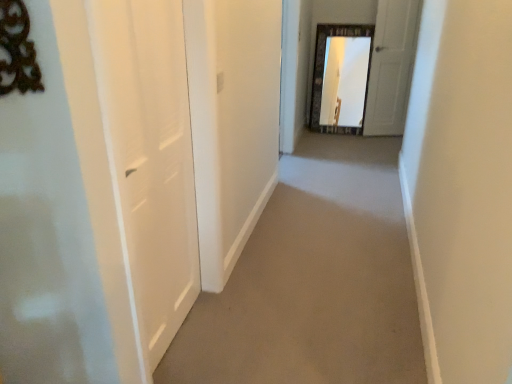
This screenshot has height=384, width=512. Describe the element at coordinates (391, 66) in the screenshot. I see `white matte door at upper right, arranged as the 2th door when viewed from the front` at that location.

What is the approximate width of white matte door at upper right, positioned as the second door in left-to-right order?

It is 2.11 inches.

This screenshot has width=512, height=384. What do you see at coordinates (314, 281) in the screenshot? I see `beige carpet at center` at bounding box center [314, 281].

Identify the location of white matte door at left, which is counted as the 1th door, starting from the front. This screenshot has height=384, width=512. (149, 160).

Which object is thinner, white matte door at upper right, arranged as the 2th door when viewed from the front, or white matte door at left, marked as the first door in a bottom-to-top arrangement?

white matte door at left, marked as the first door in a bottom-to-top arrangement, is thinner.

Which of these two, white matte door at upper right, arranged as the 2th door when viewed from the front, or white matte door at left, the second door from the top, is bigger?

With larger size is white matte door at left, the second door from the top.

Is white matte door at upper right, positioned as the 1th door in back-to-front order, oriented towards white matte door at left, the second door from the top?

No, white matte door at upper right, positioned as the 1th door in back-to-front order, is not oriented towards white matte door at left, the second door from the top.

From a real-world perspective, which object rests below the other?

From a 3D spatial view, white matte door at upper right, placed as the second door when sorted from bottom to top, is below.

Can you confirm if white matte door at left, which is counted as the second door, starting from the back, is smaller than white matte door at upper right, arranged as the 2th door when viewed from the front?

No, white matte door at left, which is counted as the second door, starting from the back, is not smaller than white matte door at upper right, arranged as the 2th door when viewed from the front.

From a real-world perspective, is white matte door at left, marked as the first door in a bottom-to-top arrangement, below white matte door at upper right, positioned as the second door in left-to-right order?

No, from a real-world perspective, white matte door at left, marked as the first door in a bottom-to-top arrangement, is not under white matte door at upper right, positioned as the second door in left-to-right order.

Would you say white matte door at left, which is the second door in right-to-left order, is outside white matte door at upper right, placed as the second door when sorted from bottom to top?

Yes, white matte door at left, which is the second door in right-to-left order, is outside of white matte door at upper right, placed as the second door when sorted from bottom to top.

In the image, is white matte door at left, which is counted as the 1th door, starting from the front, on the left side or the right side of white matte door at upper right, marked as the first door in a top-to-bottom arrangement?

From the image, it's evident that white matte door at left, which is counted as the 1th door, starting from the front, is to the left of white matte door at upper right, marked as the first door in a top-to-bottom arrangement.

Does beige carpet at center turn towards white matte door at left, which is counted as the second door, starting from the back?

No, beige carpet at center is not aimed at white matte door at left, which is counted as the second door, starting from the back.

Is beige carpet at center thinner than white matte door at left, marked as the first door in a bottom-to-top arrangement?

In fact, beige carpet at center might be wider than white matte door at left, marked as the first door in a bottom-to-top arrangement.

Considering the points (415, 334) and (115, 164), which point is behind, point (415, 334) or point (115, 164)?

The point (415, 334) is farther from the camera.

Find the location of a particular element. The image size is (512, 384). path in front of the white matte door at upper right, marked as the first door in a top-to-bottom arrangement is located at coordinates (314, 281).

From the image's perspective, is white matte door at upper right, placed as the second door when sorted from bottom to top, above or below beige carpet at center?

Based on their image positions, white matte door at upper right, placed as the second door when sorted from bottom to top, is located above beige carpet at center.

Is white matte door at upper right, placed as the second door when sorted from bottom to top, oriented away from beige carpet at center?

white matte door at upper right, placed as the second door when sorted from bottom to top, is not turned away from beige carpet at center.

Looking at this image, from a real-world perspective, which object stands above the other?

In real-world perspective, white matte door at left, the second door from the top, is above.

Looking at this image, from the image's perspective, is white matte door at left, marked as the first door in a bottom-to-top arrangement, located above or below beige carpet at center?

Clearly, from the image's perspective, white matte door at left, marked as the first door in a bottom-to-top arrangement, is above beige carpet at center.

Are white matte door at left, which appears as the 1th door when viewed from the left, and beige carpet at center located far from each other?

white matte door at left, which appears as the 1th door when viewed from the left, is near beige carpet at center, not far away.

Does point (145, 118) lie in front of point (246, 349)?

That is True.

How much distance is there between beige carpet at center and white matte door at upper right, placed as the second door when sorted from bottom to top?

beige carpet at center and white matte door at upper right, placed as the second door when sorted from bottom to top, are 1.85 meters apart.

Looking at this image, is beige carpet at center oriented towards white matte door at upper right, placed as the second door when sorted from bottom to top?

No, beige carpet at center does not turn towards white matte door at upper right, placed as the second door when sorted from bottom to top.

Does beige carpet at center have a lesser height compared to white matte door at upper right, arranged as the 1th door when viewed from the right?

Indeed, beige carpet at center has a lesser height compared to white matte door at upper right, arranged as the 1th door when viewed from the right.

Considering the relative sizes of beige carpet at center and white matte door at upper right, arranged as the 2th door when viewed from the front, in the image provided, is beige carpet at center thinner than white matte door at upper right, arranged as the 2th door when viewed from the front,?

In fact, beige carpet at center might be wider than white matte door at upper right, arranged as the 2th door when viewed from the front.

In the image, there is a white matte door at left, which is counted as the 1th door, starting from the front. Identify the location of door below it (from a real-world perspective). (391, 66).

This screenshot has width=512, height=384. Identify the location of door that appears on the right of white matte door at left, which is the second door in right-to-left order. (391, 66).

Considering their positions, is white matte door at upper right, positioned as the second door in left-to-right order, positioned further to white matte door at left, marked as the first door in a bottom-to-top arrangement, than beige carpet at center?

Based on the image, white matte door at upper right, positioned as the second door in left-to-right order, appears to be further to white matte door at left, marked as the first door in a bottom-to-top arrangement.

Which object lies nearer to the anchor point beige carpet at center, white matte door at left, which is the second door in right-to-left order, or white matte door at upper right, positioned as the second door in left-to-right order?

white matte door at left, which is the second door in right-to-left order.

Based on their spatial positions, is white matte door at left, which appears as the 1th door when viewed from the left, or beige carpet at center further from white matte door at upper right, arranged as the 1th door when viewed from the right?

white matte door at left, which appears as the 1th door when viewed from the left.

Which object lies nearer to the anchor point beige carpet at center, white matte door at upper right, placed as the second door when sorted from bottom to top, or white matte door at left, the second door from the top?

white matte door at left, the second door from the top, is closer to beige carpet at center.

From the image, which object appears to be farther from white matte door at left, which is counted as the 1th door, starting from the front, beige carpet at center or white matte door at upper right, positioned as the second door in left-to-right order?

The object further to white matte door at left, which is counted as the 1th door, starting from the front, is white matte door at upper right, positioned as the second door in left-to-right order.

Based on their spatial positions, is beige carpet at center or white matte door at left, marked as the first door in a bottom-to-top arrangement, further from white matte door at upper right, arranged as the 1th door when viewed from the right?

Among the two, white matte door at left, marked as the first door in a bottom-to-top arrangement, is located further to white matte door at upper right, arranged as the 1th door when viewed from the right.

Locate an element on the screen. Image resolution: width=512 pixels, height=384 pixels. path between white matte door at left, which is counted as the 1th door, starting from the front, and white matte door at upper right, marked as the first door in a top-to-bottom arrangement, along the z-axis is located at coordinates (314, 281).